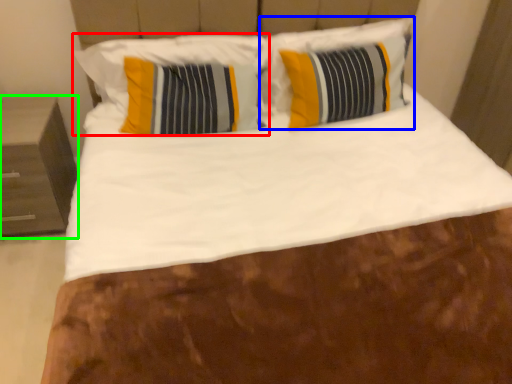
Question: Which object is the farthest from pillow (highlighted by a red box)? Choose among these: pillow (highlighted by a blue box) or nightstand (highlighted by a green box).

Choices:
 (A) pillow
 (B) nightstand

Answer: (B)